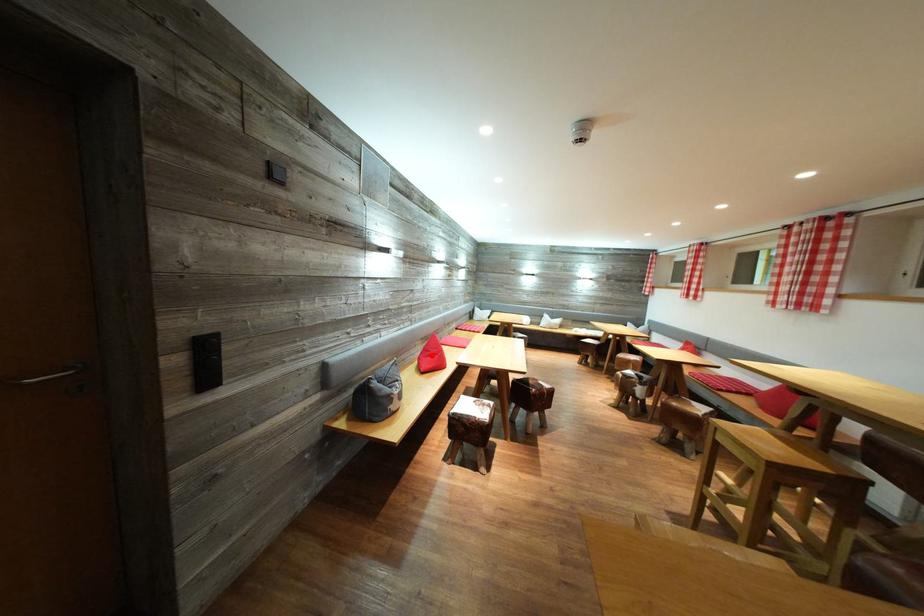
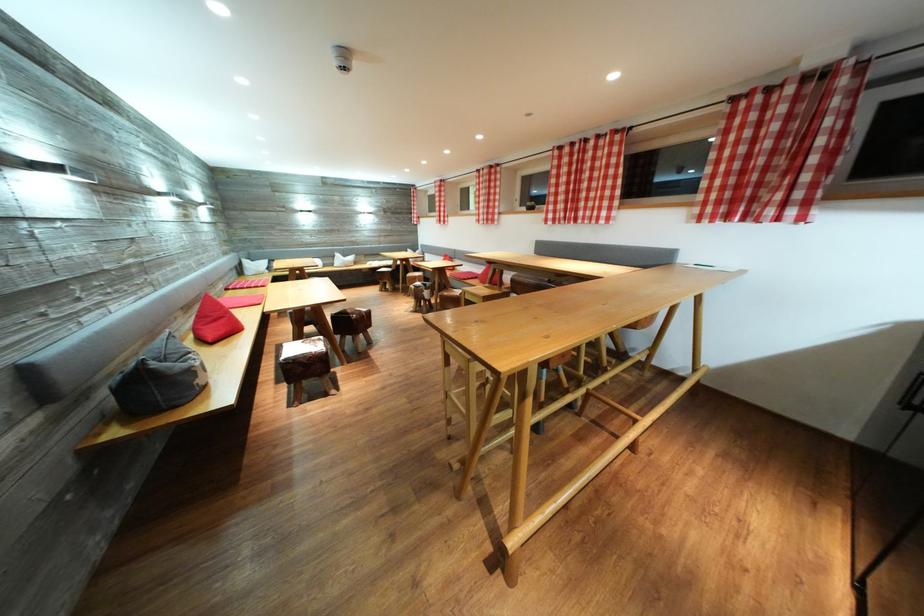
Where in the second image is the point corresponding to the highlighted location from the first image?

(207, 323)